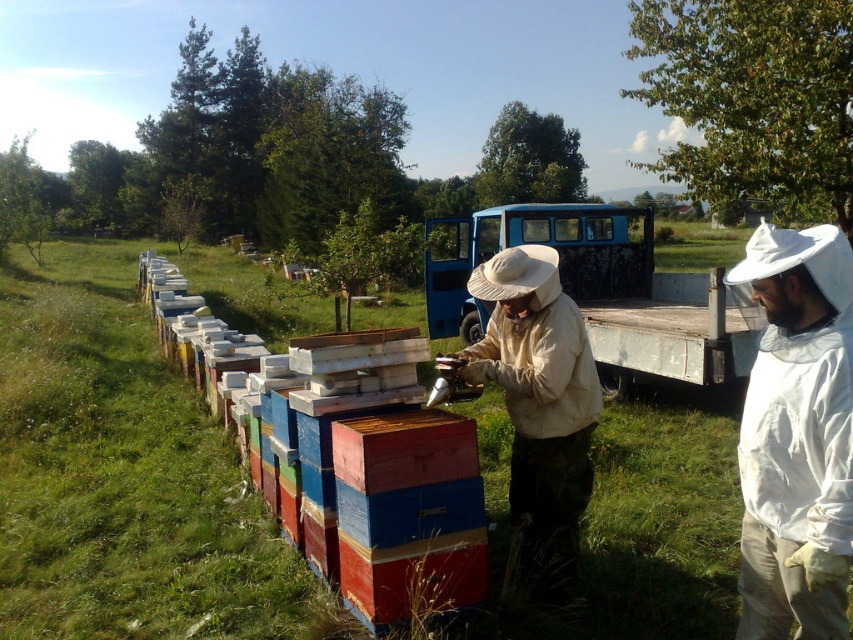
Question: Which object is positioned farthest from the white cotton beekeeper suit at center?

Choices:
 (A) wooden beehive at left
 (B) white matte beekeeper suit at center

Answer: (A)

Question: Among these points, which one is farthest from the camera?

Choices:
 (A) (560, 288)
 (B) (825, 340)
 (C) (229, 360)

Answer: (C)

Question: Which point is closer to the camera taking this photo?

Choices:
 (A) (762, 528)
 (B) (509, 276)

Answer: (A)

Question: Where is white matte beekeeper suit at center located in relation to white cotton beekeeper suit at center in the image?

Choices:
 (A) below
 (B) above

Answer: (A)

Question: Can you confirm if wooden beehive at left is wider than white cotton beekeeper suit at center?

Choices:
 (A) yes
 (B) no

Answer: (A)

Question: Is the position of white matte beekeeper suit at center more distant than that of white cotton beekeeper suit at center?

Choices:
 (A) no
 (B) yes

Answer: (A)